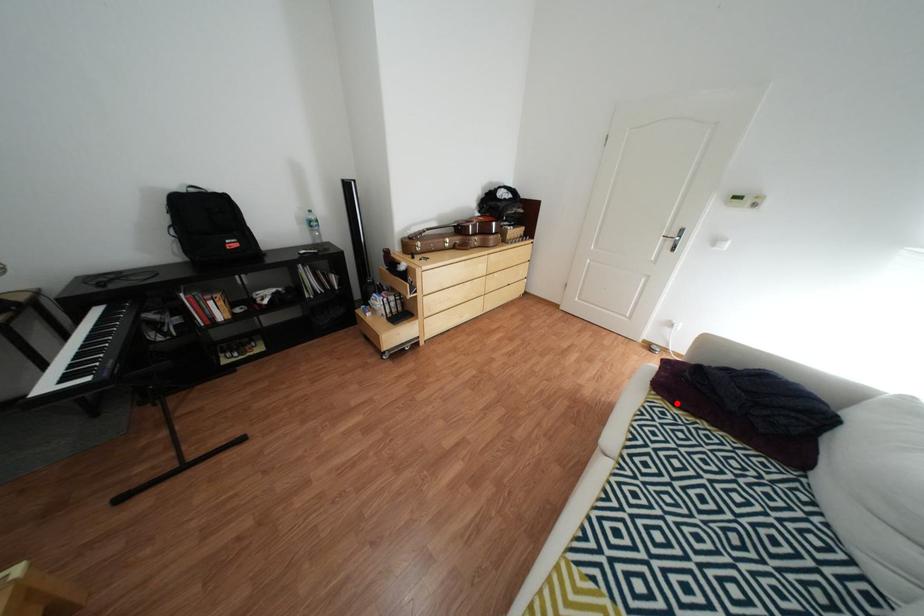
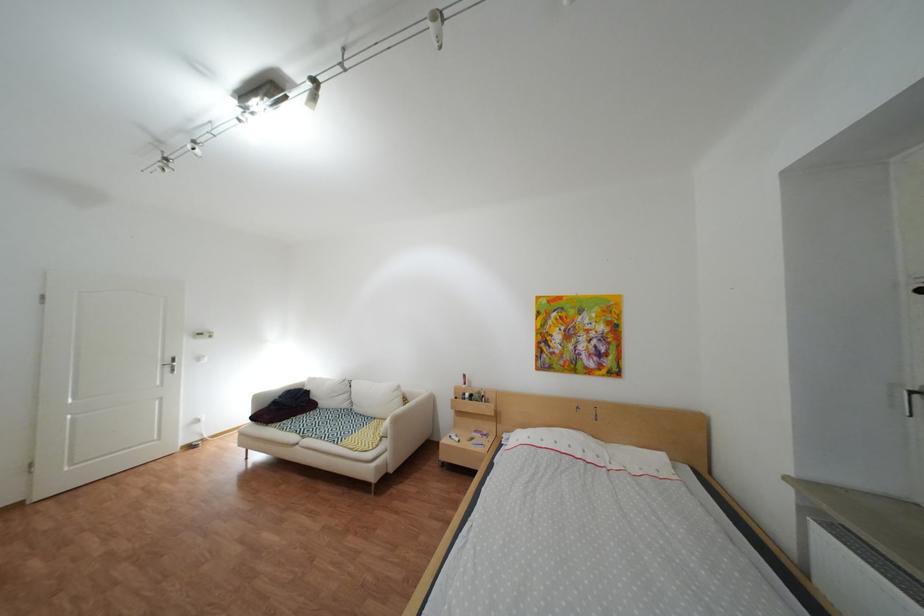
Where in the second image is the point corresponding to the highlighted location from the first image?

(294, 424)